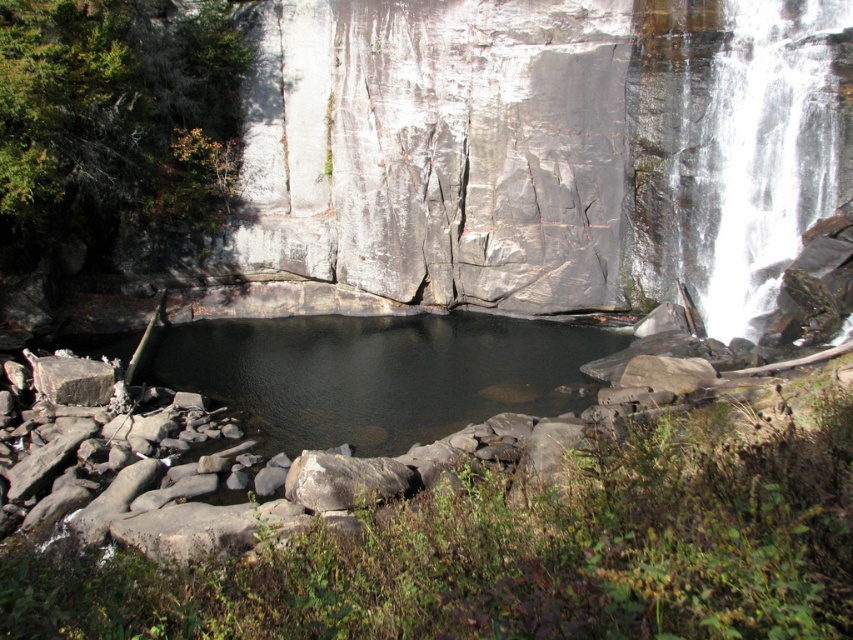
You are standing at the edge of the pool and want to locate the dark gray water at center. According to the coordinates provided, where exactly is it located?

The dark gray water at center is located at point 0.584 on the x axis and 0.443 on the y axis.